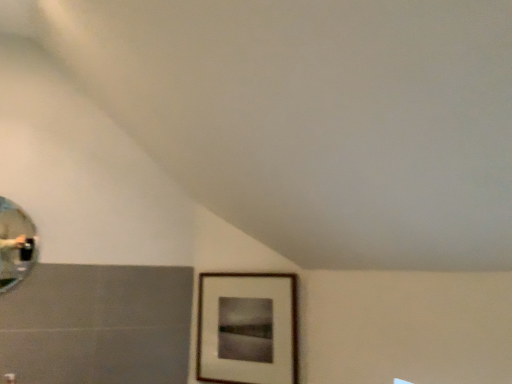
Where is `wooden picture frame at lower right`? This screenshot has width=512, height=384. wooden picture frame at lower right is located at coordinates (247, 328).

What do you see at coordinates (247, 328) in the screenshot? The image size is (512, 384). I see `wooden picture frame at lower right` at bounding box center [247, 328].

Measure the distance between shiny silver mirror at left and camera.

shiny silver mirror at left and camera are 1.88 meters apart.

This screenshot has height=384, width=512. Identify the location of shiny silver mirror at left. (15, 244).

Image resolution: width=512 pixels, height=384 pixels. What do you see at coordinates (15, 244) in the screenshot? I see `shiny silver mirror at left` at bounding box center [15, 244].

Where is `wooden picture frame at lower right`? This screenshot has width=512, height=384. wooden picture frame at lower right is located at coordinates (247, 328).

Between shiny silver mirror at left and wooden picture frame at lower right, which one appears on the right side from the viewer's perspective?

wooden picture frame at lower right is more to the right.

Is the position of shiny silver mirror at left more distant than that of wooden picture frame at lower right?

No, shiny silver mirror at left is closer to the viewer.

Is point (14, 230) more distant than point (279, 290)?

That is False.

Looking at this image, from the image's perspective, does shiny silver mirror at left appear lower than wooden picture frame at lower right?

Incorrect, from the image's perspective, shiny silver mirror at left is higher than wooden picture frame at lower right.

From a real-world perspective, is shiny silver mirror at left on top of wooden picture frame at lower right?

Yes, from a real-world perspective, shiny silver mirror at left is on top of wooden picture frame at lower right.

Looking at their sizes, would you say shiny silver mirror at left is wider or thinner than wooden picture frame at lower right?

Considering their sizes, shiny silver mirror at left looks slimmer than wooden picture frame at lower right.

Between shiny silver mirror at left and wooden picture frame at lower right, which one has more height?

wooden picture frame at lower right.

Does shiny silver mirror at left have a larger size compared to wooden picture frame at lower right?

No.

Would you say wooden picture frame at lower right is part of shiny silver mirror at left's contents?

No, wooden picture frame at lower right is not inside shiny silver mirror at left.

Is there a large distance between shiny silver mirror at left and wooden picture frame at lower right?

They are positioned close to each other.

Is shiny silver mirror at left looking in the opposite direction of wooden picture frame at lower right?

That's not correct — shiny silver mirror at left is not looking away from wooden picture frame at lower right.

What's the angular difference between shiny silver mirror at left and wooden picture frame at lower right's facing directions?

The angle between the facing direction of shiny silver mirror at left and the facing direction of wooden picture frame at lower right is 49.2 degrees.

How much distance is there between shiny silver mirror at left and wooden picture frame at lower right?

They are 39.35 inches apart.

Find the location of `picture frame below the shiny silver mirror at left (from a real-world perspective)`. picture frame below the shiny silver mirror at left (from a real-world perspective) is located at coordinates (247, 328).

Does wooden picture frame at lower right appear on the right side of shiny silver mirror at left?

Indeed, wooden picture frame at lower right is positioned on the right side of shiny silver mirror at left.

Does wooden picture frame at lower right lie in front of shiny silver mirror at left?

No.

Is point (246, 290) closer or farther from the camera than point (2, 241)?

Point (246, 290) appears to be farther away from the viewer than point (2, 241).

In the scene shown: From the image's perspective, which one is positioned lower, wooden picture frame at lower right or shiny silver mirror at left?

wooden picture frame at lower right appears lower in the image.

From a real-world perspective, who is located higher, wooden picture frame at lower right or shiny silver mirror at left?

shiny silver mirror at left, from a real-world perspective.

In terms of width, does wooden picture frame at lower right look wider or thinner when compared to shiny silver mirror at left?

wooden picture frame at lower right is wider than shiny silver mirror at left.

Considering the relative sizes of wooden picture frame at lower right and shiny silver mirror at left in the image provided, is wooden picture frame at lower right shorter than shiny silver mirror at left?

No, wooden picture frame at lower right is not shorter than shiny silver mirror at left.

Based on their sizes in the image, would you say wooden picture frame at lower right is bigger or smaller than shiny silver mirror at left?

Considering their sizes, wooden picture frame at lower right takes up more space than shiny silver mirror at left.

Looking at this image, is wooden picture frame at lower right spatially inside shiny silver mirror at left, or outside of it?

wooden picture frame at lower right is not enclosed by shiny silver mirror at left.

Based on the photo, are wooden picture frame at lower right and shiny silver mirror at left located far from each other?

No, there isn't a large distance between wooden picture frame at lower right and shiny silver mirror at left.

Is wooden picture frame at lower right looking in the opposite direction of shiny silver mirror at left?

wooden picture frame at lower right is not turned away from shiny silver mirror at left.

Can you tell me how much wooden picture frame at lower right and shiny silver mirror at left differ in facing direction?

The facing directions of wooden picture frame at lower right and shiny silver mirror at left are 49.2 degrees apart.

The image size is (512, 384). I want to click on mirror that appears above the wooden picture frame at lower right (from the image's perspective), so pos(15,244).

The height and width of the screenshot is (384, 512). What are the coordinates of `mirror on the left of wooden picture frame at lower right` in the screenshot? It's located at (15, 244).

Image resolution: width=512 pixels, height=384 pixels. Identify the location of picture frame located behind the shiny silver mirror at left. (247, 328).